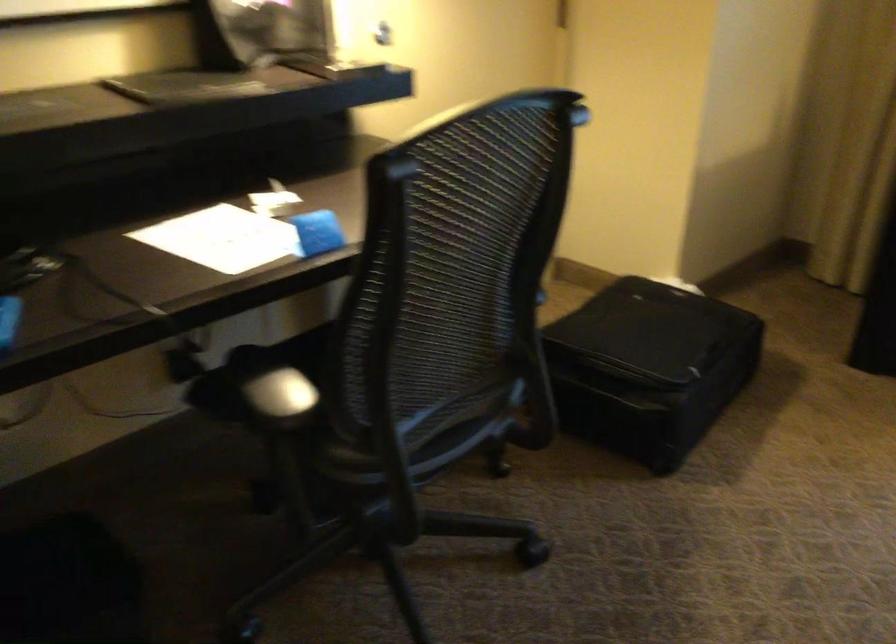
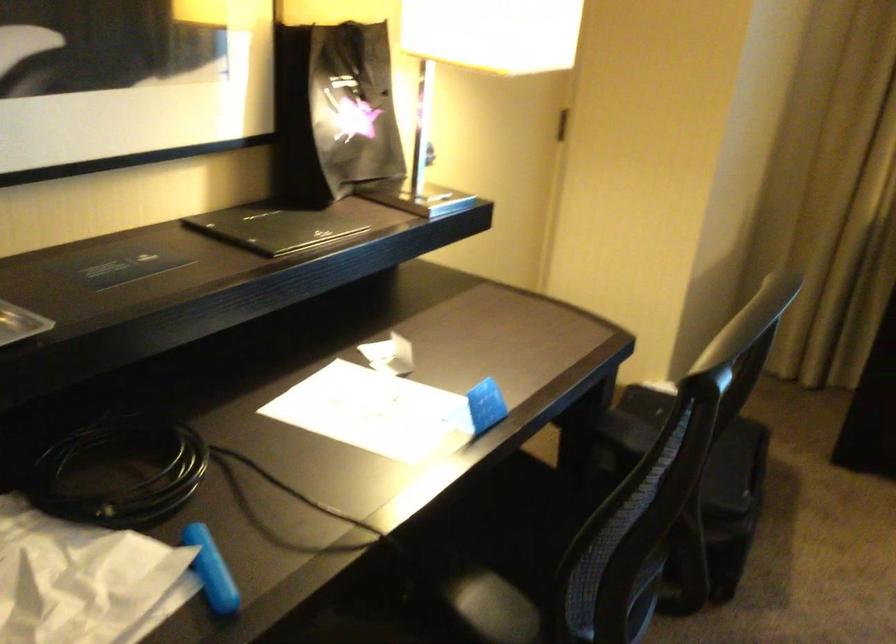
The point at (642, 487) is marked in the first image. Where is the corresponding point in the second image?

(709, 618)